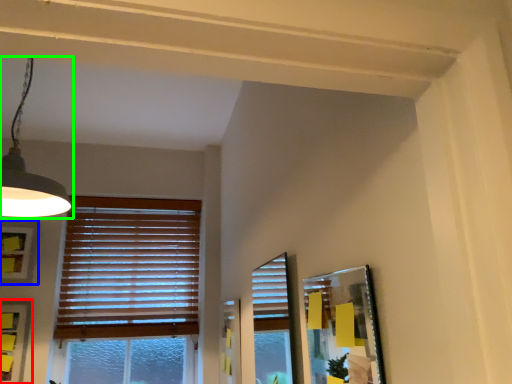
Question: Estimate the real-world distances between objects in this image. Which object is farther from picture frame (highlighted by a red box), picture frame (highlighted by a blue box) or lamp (highlighted by a green box)?

Choices:
 (A) picture frame
 (B) lamp

Answer: (B)